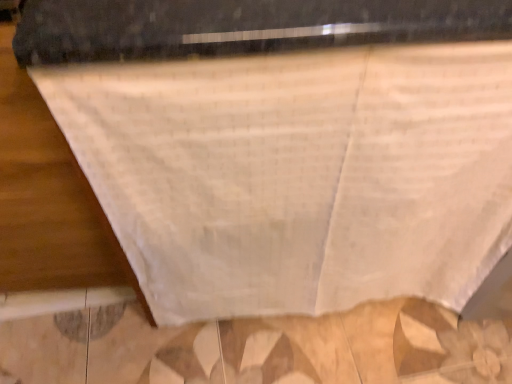
What is the approximate width of white fabric curtain at center?

It is 3.42 inches.

The image size is (512, 384). What do you see at coordinates (298, 174) in the screenshot? I see `white fabric curtain at center` at bounding box center [298, 174].

What are the coordinates of `white fabric curtain at center` in the screenshot? It's located at (298, 174).

Where is `white fabric curtain at center`? The height and width of the screenshot is (384, 512). white fabric curtain at center is located at coordinates (298, 174).